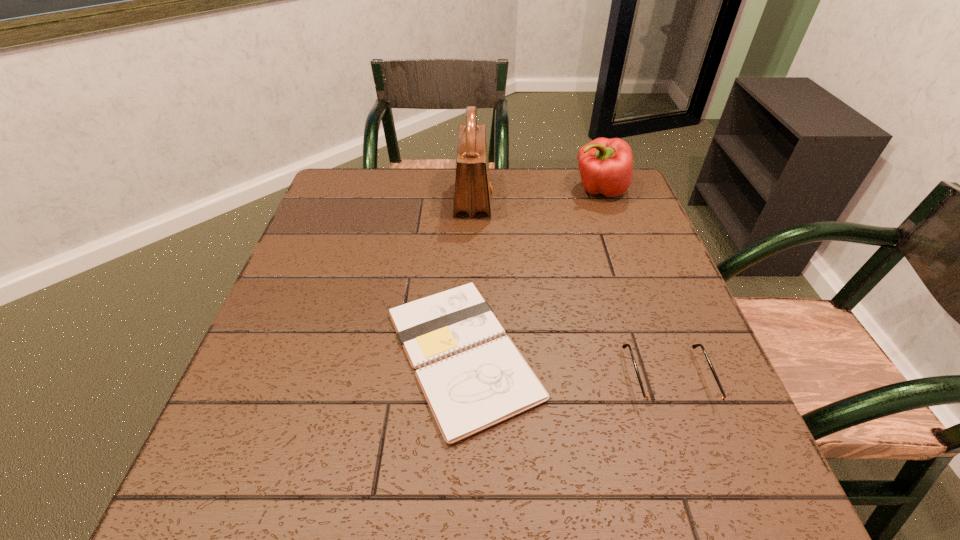
The height and width of the screenshot is (540, 960). Find the location of `free spot between the second tallest object and the notepad`. free spot between the second tallest object and the notepad is located at coordinates point(531,272).

You are a GUI agent. You are given a task and a screenshot of the screen. Output one action in this format:
    pyautogui.click(x=<x>, y=<y>)
    Task: Click on the free space between the shoulder bag and the spectacles
    
    Given the screenshot: What is the action you would take?
    pyautogui.click(x=570, y=291)

At what (x,y) coordinates should I click in order to perform the action: click on vacant point located between the tallest object and the second shortest object. Please return your answer as a coordinate pair (x, y). The height and width of the screenshot is (540, 960). Looking at the image, I should click on (570, 291).

This screenshot has height=540, width=960. Identify the location of vacant point located between the bell pepper and the spectacles. (634, 285).

The image size is (960, 540). What are the coordinates of `free space between the notepad and the bell pepper` in the screenshot? It's located at (531, 272).

Where is `vacant space that is in between the spectacles and the second tallest object`? vacant space that is in between the spectacles and the second tallest object is located at coordinates (634, 285).

At what (x,y) coordinates should I click in order to perform the action: click on empty space between the shoulder bag and the bell pepper. Please return your answer as a coordinate pair (x, y). The image size is (960, 540). Looking at the image, I should click on point(537,195).

This screenshot has width=960, height=540. Find the location of `vacant area that lies between the notepad and the third tallest object`. vacant area that lies between the notepad and the third tallest object is located at coordinates (564, 367).

Identify the location of empty space that is in between the shortest object and the shoulder bag. (468, 278).

Select which object appears as the closest to the shortest object. Please provide its 2D coordinates. Your answer should be formatted as a tuple, i.e. [(x, y)], where the tuple contains the x and y coordinates of a point satisfying the conditions above.

[(651, 403)]